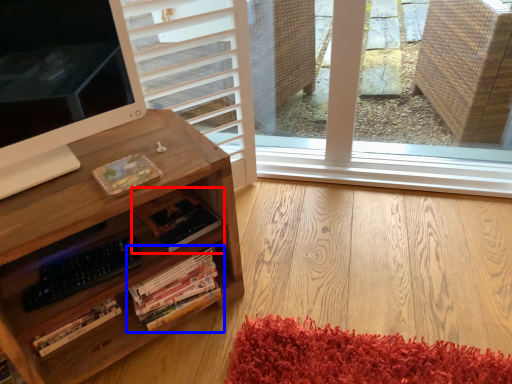
Question: Which point is closer to the camera, book (highlighted by a red box) or book (highlighted by a blue box)?

Choices:
 (A) book
 (B) book

Answer: (B)